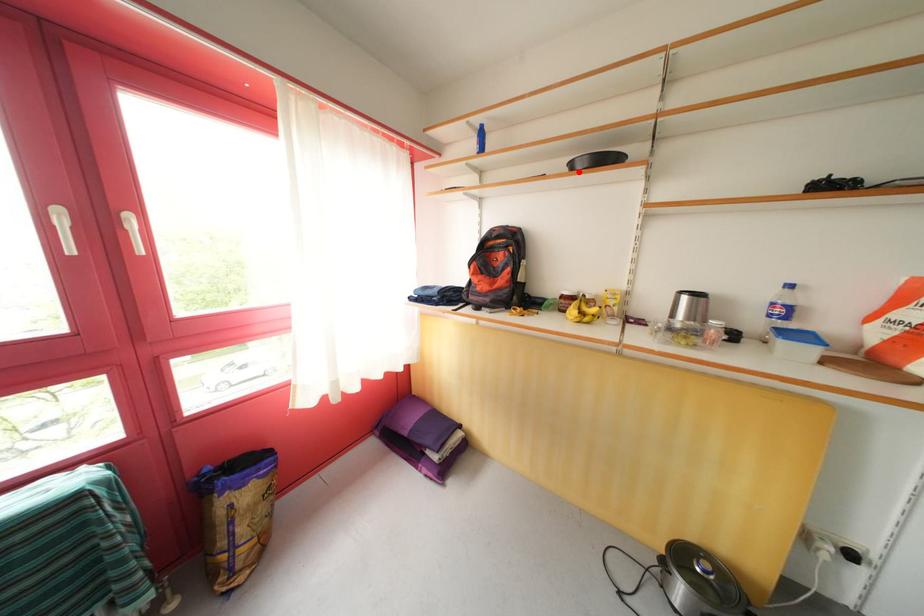
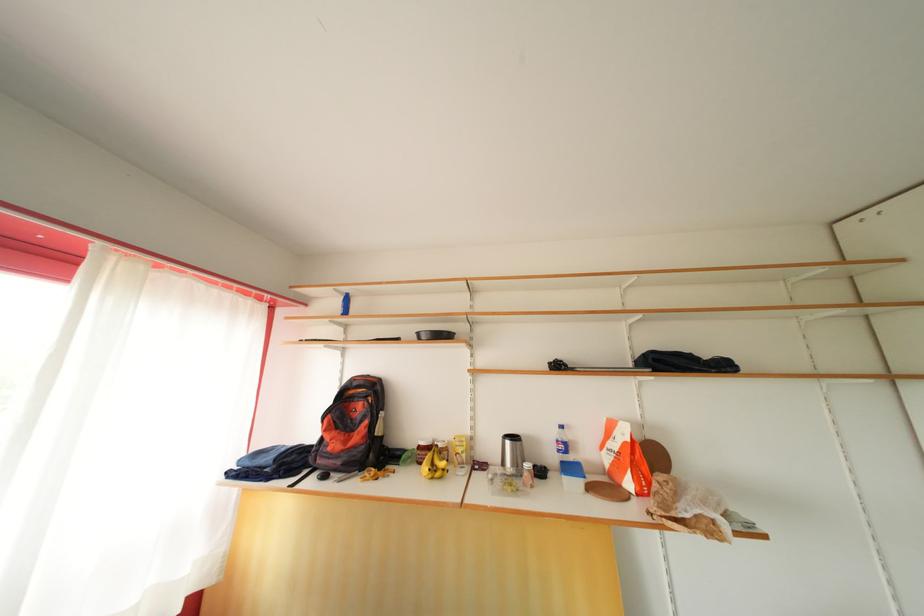
Locate, in the second image, the point that corresponds to the highlighted location in the first image.

(426, 341)